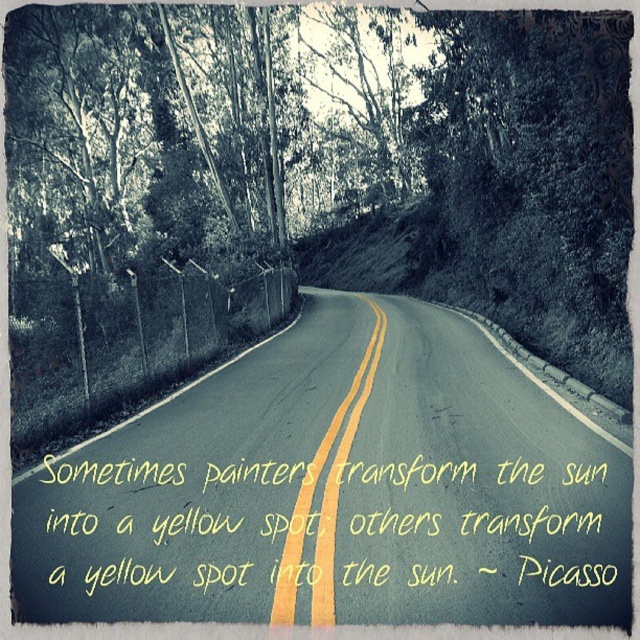
You are driving a car that is 2 meters wide and want to stay entirely within the yellow asphalt road at center while avoiding crossing the yellow painted lines at center. Can your car fit within the road without crossing the lines?

The yellow asphalt road at center is wider than the yellow painted lines at center. Since the car is 2 meters wide, it can fit within the road as long as it stays between the yellow painted lines at center, which are narrower than the road itself.

You are a photographer standing at the starting point of the curving road. You want to take a photo that includes both the point at (45, 516) and the point at (330, 561). Which point should you focus on first to ensure both are in sharp focus?

You should focus on the point at (45, 516) first because it is closer to you than the point at (330, 561). Since it is nearer, focusing on it will help ensure the farther point remains within the depth of field for sharpness.

You are standing at the starting point of the yellow asphalt road at center. If you walk straight ahead, will you eventually reach the end of the road? Explain using its 2D coordinates.

The yellow asphalt road at center is located at point (339, 490) in 2D coordinates. Since roads typically extend beyond their depicted points, you would continue walking forward and eventually reach the end of the road.